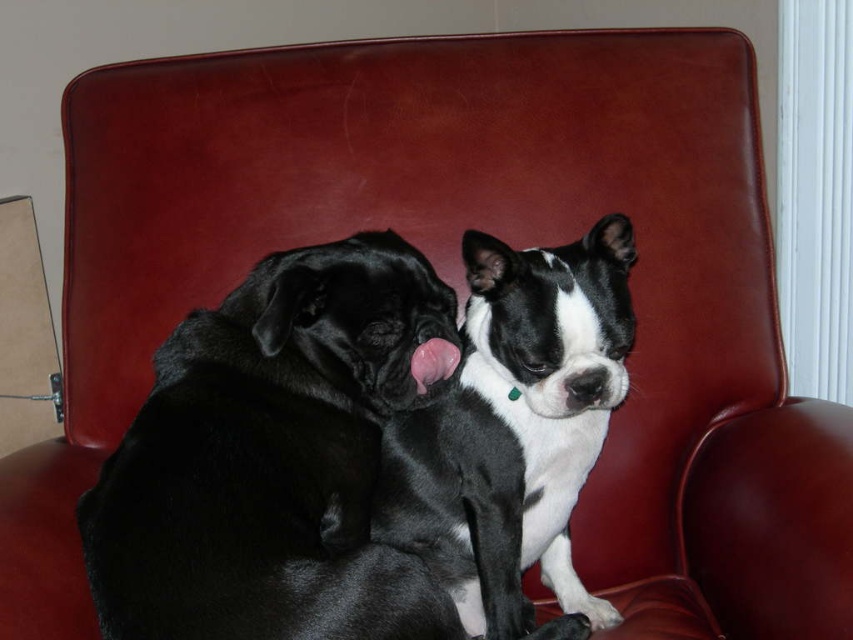
Question: Which of the following is the farthest from the observer?

Choices:
 (A) (596, 276)
 (B) (300, 614)

Answer: (A)

Question: Which point is closer to the camera?

Choices:
 (A) (520, 625)
 (B) (328, 548)

Answer: (B)

Question: Which point is farther to the camera?

Choices:
 (A) (287, 273)
 (B) (462, 563)

Answer: (B)

Question: Can you confirm if black fur dog at left is positioned below black glossy dog at center?

Choices:
 (A) no
 (B) yes

Answer: (A)

Question: Is black fur dog at left above black glossy dog at center?

Choices:
 (A) no
 (B) yes

Answer: (B)

Question: Does black fur dog at left have a greater width compared to black glossy dog at center?

Choices:
 (A) no
 (B) yes

Answer: (B)